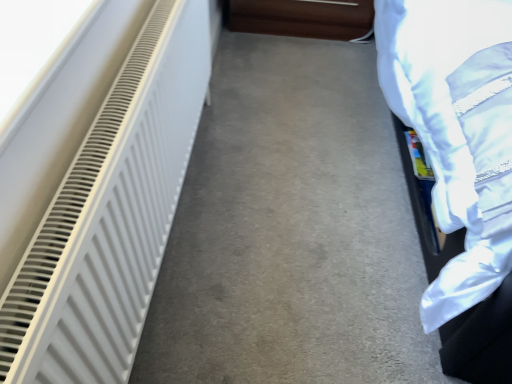
Question: Considering the relative sizes of brown leather couch at upper center and white matte radiator at left in the image provided, is brown leather couch at upper center shorter than white matte radiator at left?

Choices:
 (A) no
 (B) yes

Answer: (B)

Question: Would you say brown leather couch at upper center is outside white matte radiator at left?

Choices:
 (A) no
 (B) yes

Answer: (B)

Question: From the image's perspective, is brown leather couch at upper center under white matte radiator at left?

Choices:
 (A) no
 (B) yes

Answer: (A)

Question: Does brown leather couch at upper center have a larger size compared to white matte radiator at left?

Choices:
 (A) yes
 (B) no

Answer: (A)

Question: Can you confirm if brown leather couch at upper center is thinner than white matte radiator at left?

Choices:
 (A) no
 (B) yes

Answer: (A)

Question: Is brown leather couch at upper center behind white matte radiator at left?

Choices:
 (A) no
 (B) yes

Answer: (B)

Question: Considering the relative sizes of white matte radiator at left and brown leather couch at upper center in the image provided, is white matte radiator at left taller than brown leather couch at upper center?

Choices:
 (A) yes
 (B) no

Answer: (B)

Question: Does white matte radiator at left have a smaller size compared to brown leather couch at upper center?

Choices:
 (A) yes
 (B) no

Answer: (A)

Question: From the image's perspective, is white matte radiator at left under brown leather couch at upper center?

Choices:
 (A) no
 (B) yes

Answer: (B)

Question: Does white matte radiator at left appear on the right side of brown leather couch at upper center?

Choices:
 (A) no
 (B) yes

Answer: (A)

Question: Would you consider white matte radiator at left to be distant from brown leather couch at upper center?

Choices:
 (A) no
 (B) yes

Answer: (A)

Question: Can you confirm if white matte radiator at left is bigger than brown leather couch at upper center?

Choices:
 (A) yes
 (B) no

Answer: (B)

Question: Is white matte radiator at left turned away from brown leather couch at upper center?

Choices:
 (A) yes
 (B) no

Answer: (B)